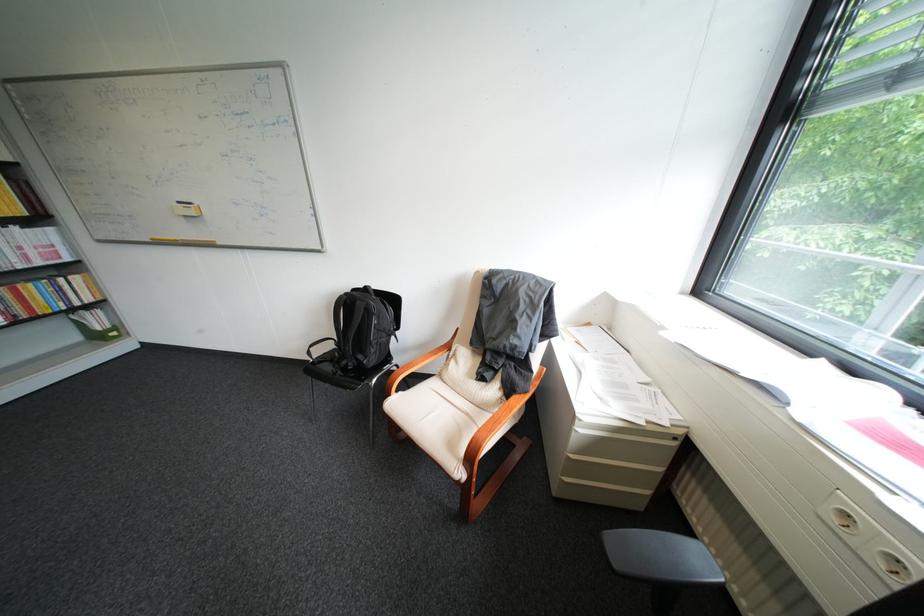
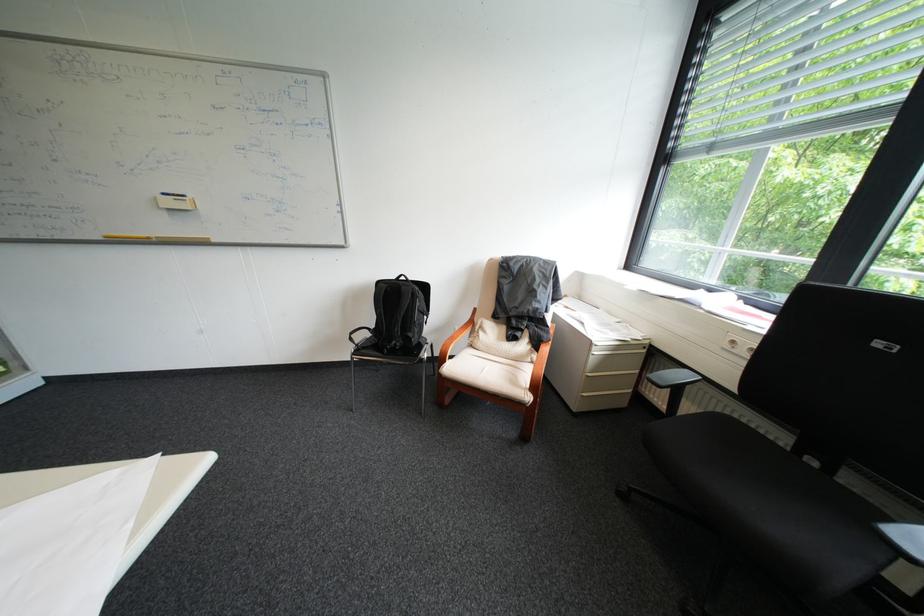
Question: I am providing you with two images of the same scene from different viewpoints. Which of the following objects are not visible in image2?

Choices:
 (A) backpack handle
 (B) yellow marker
 (C) whiteboard eraser
 (D) none of these

Answer: (D)